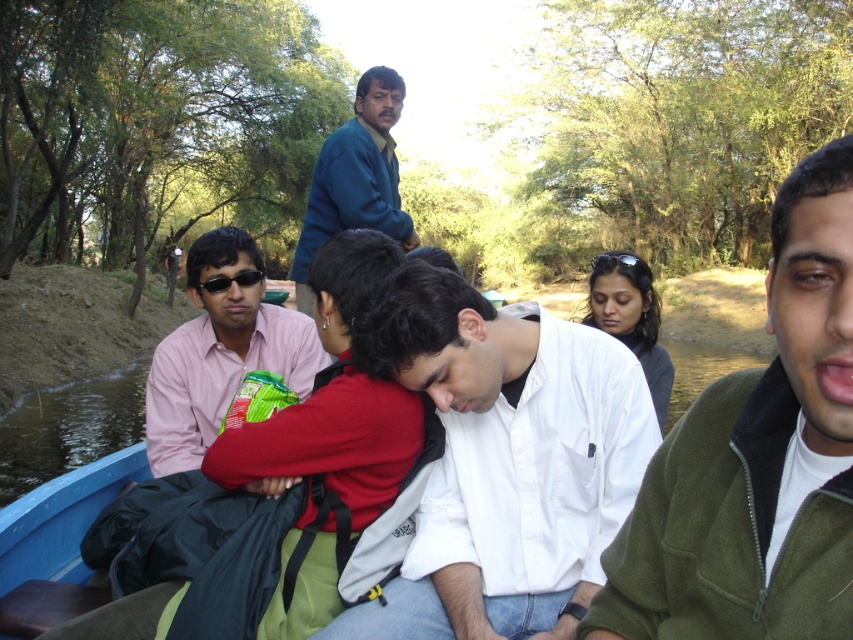
Question: Which of the following is the farthest from the observer?

Choices:
 (A) black plastic sunglasses at left
 (B) pink shirt at left

Answer: (A)

Question: Among these objects, which one is nearest to the camera?

Choices:
 (A) black plastic sunglasses at left
 (B) teal sweater at upper center
 (C) green fleece jacket at upper right

Answer: (C)

Question: Does pink shirt at left lie behind teal sweater at upper center?

Choices:
 (A) yes
 (B) no

Answer: (B)

Question: From the image, what is the correct spatial relationship of pink shirt at left in relation to black plastic sunglasses at left?

Choices:
 (A) above
 (B) below

Answer: (B)

Question: Among these objects, which one is nearest to the camera?

Choices:
 (A) teal sweater at upper center
 (B) white matte shirt at center
 (C) black plastic sunglasses at left

Answer: (B)

Question: Where is white matte shirt at center located in relation to pink shirt at left in the image?

Choices:
 (A) below
 (B) above

Answer: (A)